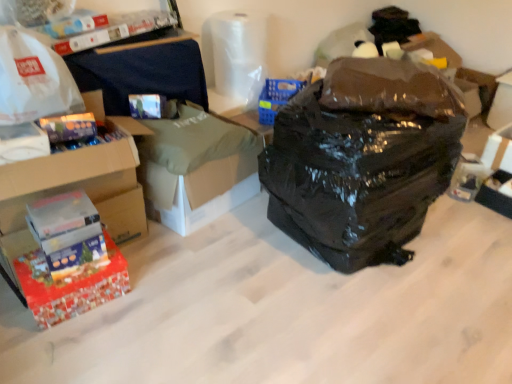
Question: Considering the relative sizes of white cardboard box at center and red glossy box at lower left, the third box positioned from the top, in the image provided, is white cardboard box at center wider than red glossy box at lower left, the third box positioned from the top,?

Choices:
 (A) no
 (B) yes

Answer: (B)

Question: Is white cardboard box at center positioned with its back to red glossy box at lower left, the third box positioned from the top?

Choices:
 (A) yes
 (B) no

Answer: (B)

Question: Considering the relative sizes of white cardboard box at center and red glossy box at lower left, the third box positioned from the top, in the image provided, is white cardboard box at center shorter than red glossy box at lower left, the third box positioned from the top,?

Choices:
 (A) yes
 (B) no

Answer: (B)

Question: Is white cardboard box at center to the right of red glossy box at lower left, the third box positioned from the top, from the viewer's perspective?

Choices:
 (A) no
 (B) yes

Answer: (B)

Question: Is white cardboard box at center not close to red glossy box at lower left, the third box positioned from the top?

Choices:
 (A) yes
 (B) no

Answer: (B)

Question: From the image's perspective, is red glossy box at lower left, the third box positioned from the top, located above or below black plastic storage box at lower right, which ranks as the 1th storage box in bottom-to-top order?

Choices:
 (A) below
 (B) above

Answer: (A)

Question: Visually, is red glossy box at lower left, the 1th box from the bottom, positioned to the left or to the right of black plastic storage box at lower right, which ranks as the 3th storage box in top-to-bottom order?

Choices:
 (A) right
 (B) left

Answer: (B)

Question: Is red glossy box at lower left, the 1th box from the bottom, inside or outside of black plastic storage box at lower right, which ranks as the 3th storage box in top-to-bottom order?

Choices:
 (A) inside
 (B) outside

Answer: (B)

Question: Considering their positions, is red glossy box at lower left, the third box positioned from the top, located in front of or behind black plastic storage box at lower right, which ranks as the 1th storage box in bottom-to-top order?

Choices:
 (A) behind
 (B) front

Answer: (B)

Question: Considering the positions of white cardboard box at right, the 2th storage box from the front, and red cardboard box at lower left, marked as the second box in a bottom-to-top arrangement, in the image, is white cardboard box at right, the 2th storage box from the front, bigger or smaller than red cardboard box at lower left, marked as the second box in a bottom-to-top arrangement,?

Choices:
 (A) small
 (B) big

Answer: (A)

Question: Relative to red cardboard box at lower left, which is the second box in top-to-bottom order, is white cardboard box at right, the second storage box from the bottom, in front or behind?

Choices:
 (A) front
 (B) behind

Answer: (B)

Question: Does point (486, 144) appear closer or farther from the camera than point (98, 94)?

Choices:
 (A) closer
 (B) farther

Answer: (B)

Question: Considering the positions of white cardboard box at right, the second storage box from the bottom, and red cardboard box at lower left, marked as the second box in a bottom-to-top arrangement, in the image, is white cardboard box at right, the second storage box from the bottom, taller or shorter than red cardboard box at lower left, marked as the second box in a bottom-to-top arrangement,?

Choices:
 (A) tall
 (B) short

Answer: (A)

Question: Is white cardboard box at center in front of or behind white cardboard box at right, acting as the second storage box starting from the back, in the image?

Choices:
 (A) front
 (B) behind

Answer: (A)

Question: Considering the positions of white cardboard box at center and white cardboard box at right, acting as the second storage box starting from the back, in the image, is white cardboard box at center bigger or smaller than white cardboard box at right, acting as the second storage box starting from the back,?

Choices:
 (A) big
 (B) small

Answer: (A)